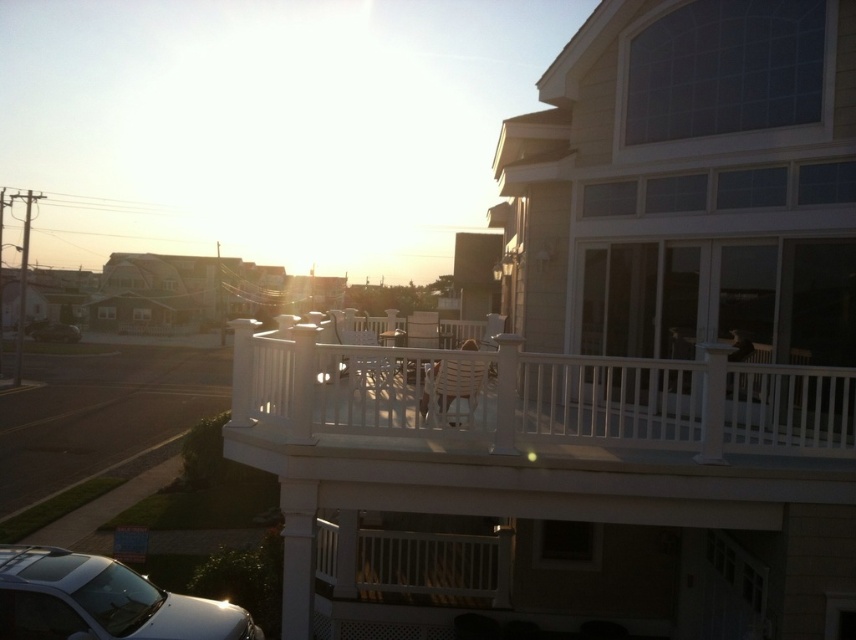
Question: Which point is closer to the camera taking this photo?

Choices:
 (A) (804, 371)
 (B) (52, 330)
 (C) (185, 618)

Answer: (A)

Question: In this image, where is white plastic porch at center located relative to metallic silver car at lower left?

Choices:
 (A) above
 (B) below

Answer: (A)

Question: Can you confirm if white plastic porch at center is thinner than metallic silver car at lower left?

Choices:
 (A) no
 (B) yes

Answer: (A)

Question: Which point is closer to the camera?

Choices:
 (A) (36, 339)
 (B) (290, 404)
 (C) (13, 563)

Answer: (B)

Question: Is white plastic porch at center thinner than metallic silver car at lower left?

Choices:
 (A) yes
 (B) no

Answer: (B)

Question: Which is farther from the white plastic porch at center?

Choices:
 (A) metallic silver car at lower left
 (B) satin silver suv at lower left

Answer: (A)